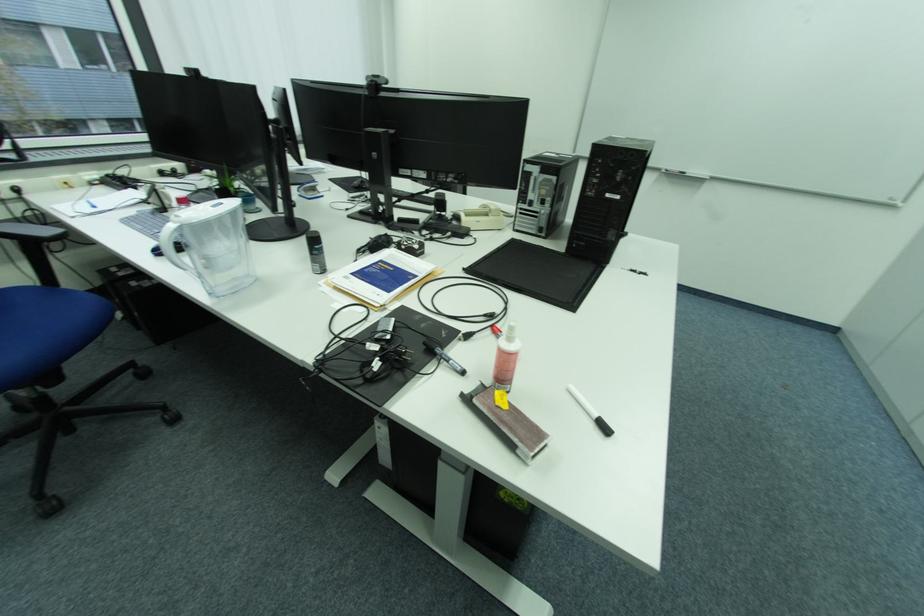
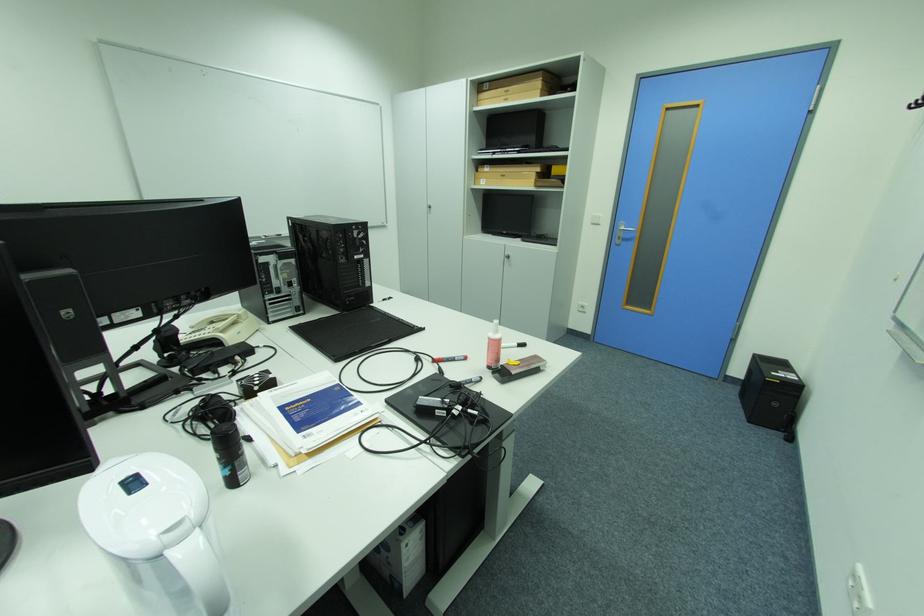
Find the pixel in the second image that matches (499,211) in the first image.

(247, 315)